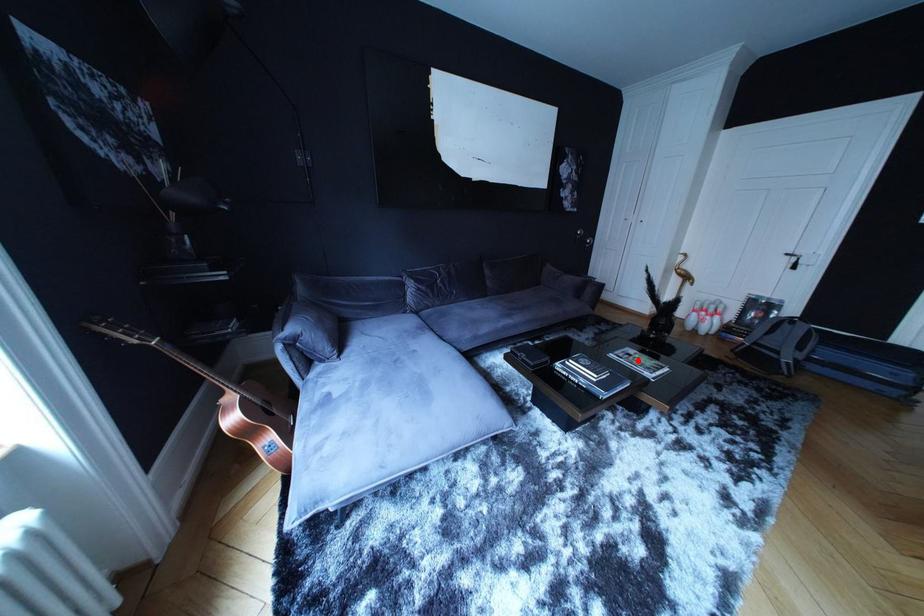
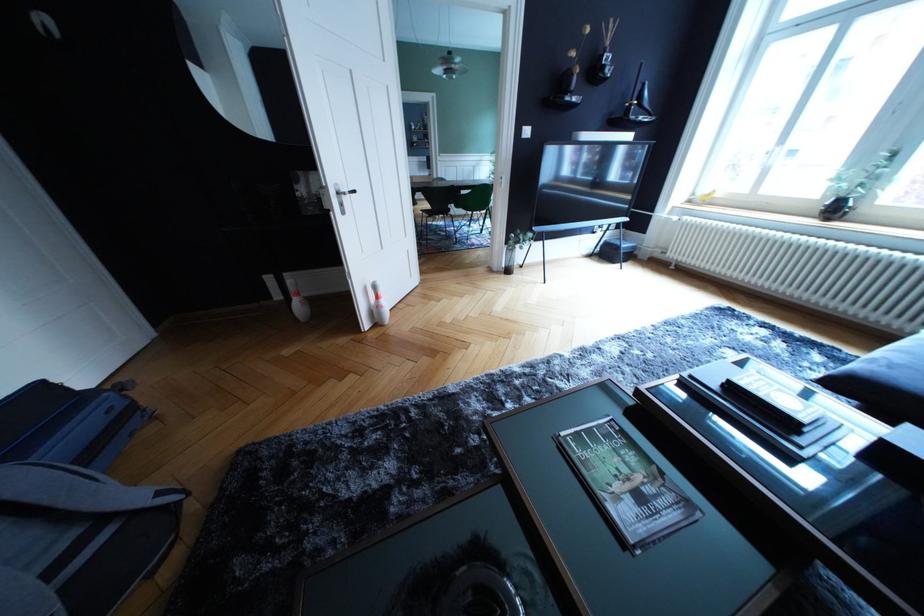
Find the pixel in the second image that matches the highlighted location in the first image.

(649, 504)